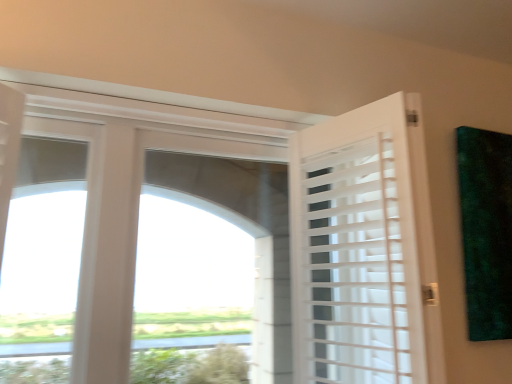
Question: In terms of size, does white matte door at right appear bigger or smaller than green matte painting at upper right?

Choices:
 (A) small
 (B) big

Answer: (B)

Question: From a real-world perspective, relative to green matte painting at upper right, is white matte door at right vertically above or below?

Choices:
 (A) below
 (B) above

Answer: (A)

Question: Is white matte door at right situated inside green matte painting at upper right or outside?

Choices:
 (A) outside
 (B) inside

Answer: (A)

Question: Based on their sizes in the image, would you say green matte painting at upper right is bigger or smaller than white matte door at right?

Choices:
 (A) big
 (B) small

Answer: (B)

Question: From the image's perspective, is green matte painting at upper right located above or below white matte door at right?

Choices:
 (A) above
 (B) below

Answer: (A)

Question: Considering the relative positions of green matte painting at upper right and white matte door at right in the image provided, is green matte painting at upper right to the left or to the right of white matte door at right?

Choices:
 (A) right
 (B) left

Answer: (A)

Question: From a real-world perspective, is green matte painting at upper right physically located above or below white matte door at right?

Choices:
 (A) above
 (B) below

Answer: (A)